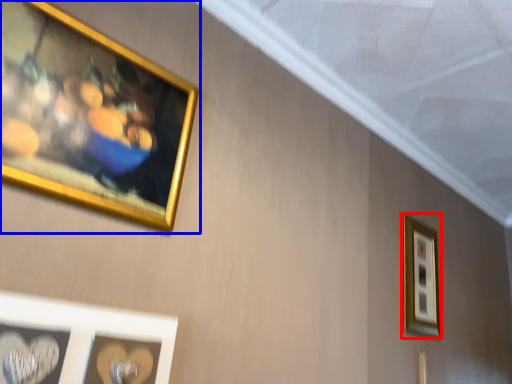
Question: Among these objects, which one is nearest to the camera, picture frame (highlighted by a red box) or picture frame (highlighted by a blue box)?

Choices:
 (A) picture frame
 (B) picture frame

Answer: (B)